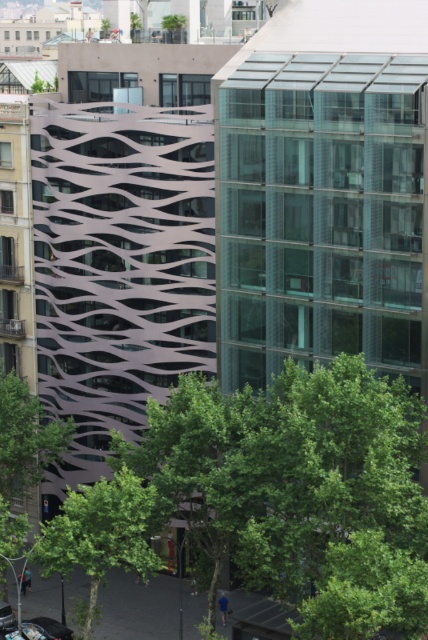
Looking at this image, can you confirm if green leafy tree at center is taller than green leafy tree at lower center?

Indeed, green leafy tree at center has a greater height compared to green leafy tree at lower center.

Between green leafy tree at center and green leafy tree at lower center, which one is positioned lower?

Positioned lower is green leafy tree at lower center.

Is point (315, 508) farther from viewer compared to point (61, 548)?

No, (315, 508) is closer to viewer.

Identify the location of green leafy tree at center. This screenshot has width=428, height=640. (297, 484).